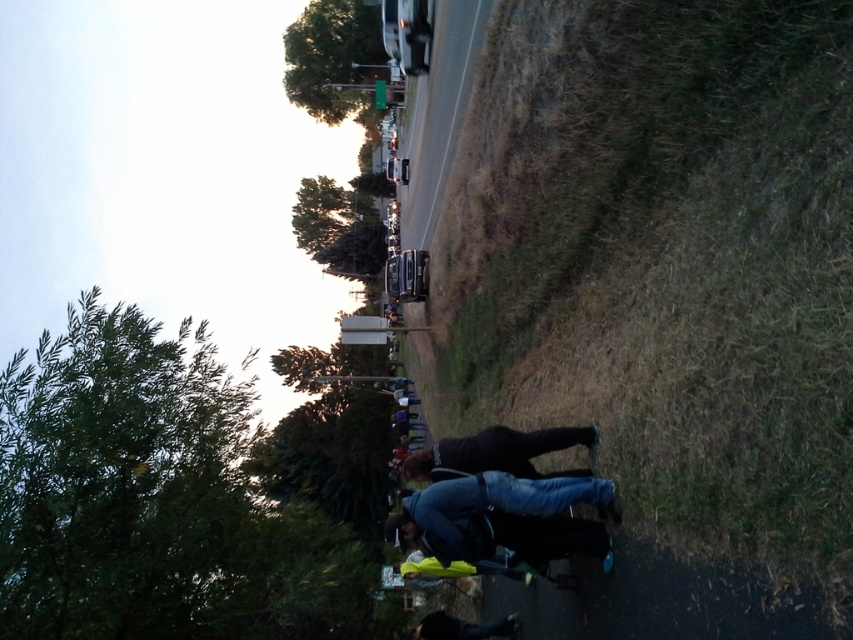
Question: Which object is farther from the camera taking this photo?

Choices:
 (A) dark gray smooth skateboard at center
 (B) dark blue denim jeans at lower center

Answer: (A)

Question: Does dry grass at right have a greater width compared to dark gray smooth skateboard at center?

Choices:
 (A) no
 (B) yes

Answer: (A)

Question: Can you confirm if dry grass at right is positioned below dark blue denim jeans at lower center?

Choices:
 (A) no
 (B) yes

Answer: (A)

Question: Can you confirm if dry grass at right is wider than dark blue denim jeans at lower center?

Choices:
 (A) no
 (B) yes

Answer: (A)

Question: Among these objects, which one is nearest to the camera?

Choices:
 (A) dark blue denim jeans at lower center
 (B) dark gray smooth skateboard at center

Answer: (A)

Question: Which point is farther from the camera taking this photo?

Choices:
 (A) (726, 598)
 (B) (521, 435)
 (C) (518, 525)

Answer: (B)